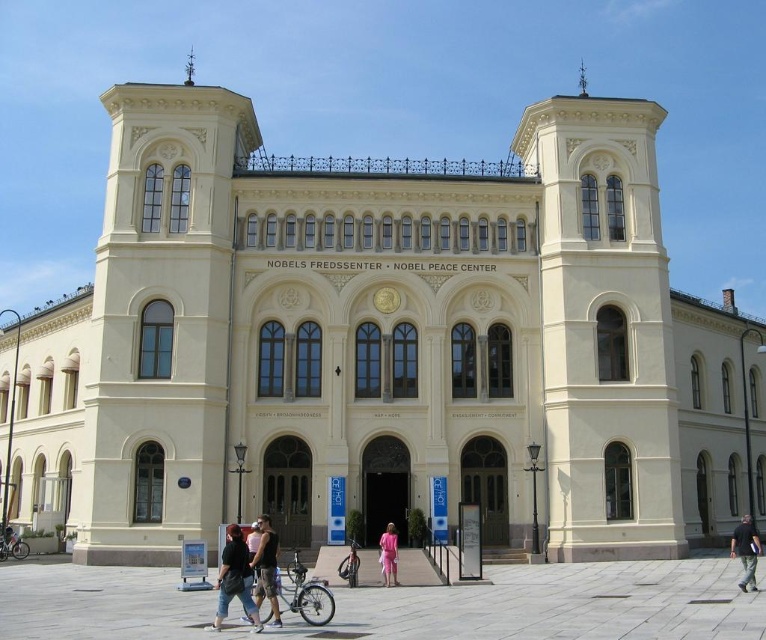
Between dark blue jeans at lower center and pink fabric dress at center, which one appears on the left side from the viewer's perspective?

Positioned to the left is dark blue jeans at lower center.

Between point (241, 588) and point (391, 529), which one is positioned behind?

Point (391, 529)

Locate an element on the screen. The image size is (766, 640). dark blue jeans at lower center is located at coordinates (234, 579).

Who is more distant from viewer, (275, 568) or (751, 545)?

Positioned behind is point (751, 545).

Looking at this image, can you confirm if dark brown leather jacket at center is positioned to the left of black cotton shirt at center?

Correct, you'll find dark brown leather jacket at center to the left of black cotton shirt at center.

Is point (254, 557) farther from viewer compared to point (745, 552)?

No, it is not.

At what (x,y) coordinates should I click in order to perform the action: click on dark brown leather jacket at center. Please return your answer as a coordinate pair (x, y). Image resolution: width=766 pixels, height=640 pixels. Looking at the image, I should click on (264, 564).

The image size is (766, 640). What do you see at coordinates (264, 564) in the screenshot?
I see `dark brown leather jacket at center` at bounding box center [264, 564].

Who is more distant from viewer, (270,570) or (393,547)?

The point (393,547) is behind.

Identify the location of dark brown leather jacket at center. The height and width of the screenshot is (640, 766). (264, 564).